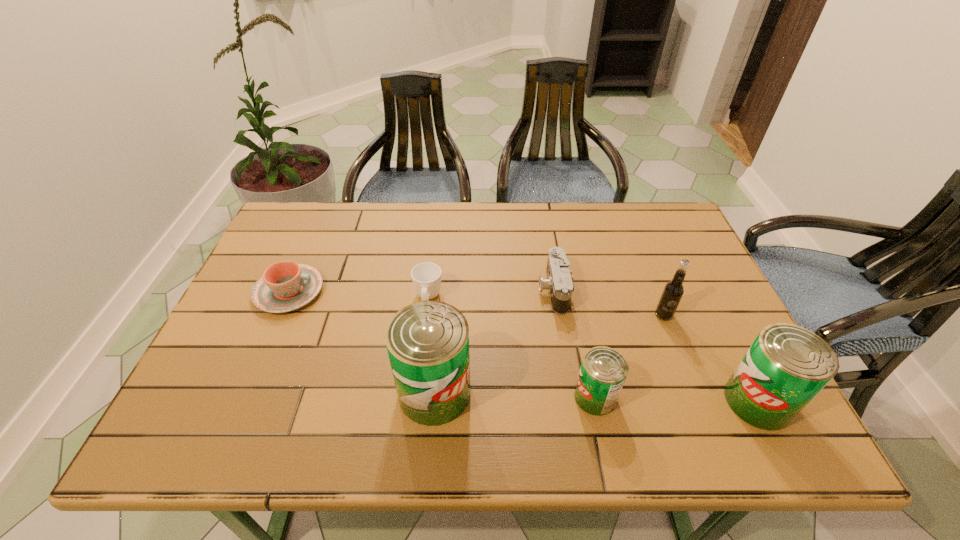
Locate an element on the screen. Image resolution: width=960 pixels, height=540 pixels. the leftmost can is located at coordinates (427, 342).

In order to click on the shortest can in this screenshot , I will do `click(603, 371)`.

At what (x,y) coordinates should I click in order to perform the action: click on the fourth shortest object. Please return your answer as a coordinate pair (x, y). Looking at the image, I should click on (603, 371).

Image resolution: width=960 pixels, height=540 pixels. I want to click on the second shortest can, so click(787, 365).

What are the coordinates of `the rightmost object` in the screenshot? It's located at (787, 365).

Where is `root beer`? This screenshot has height=540, width=960. root beer is located at coordinates (672, 293).

Find the location of a particular element. camera is located at coordinates (559, 284).

At what (x,y) coordinates should I click in order to perform the action: click on the leftmost object. Please return your answer as a coordinate pair (x, y). The image size is (960, 540). Looking at the image, I should click on (285, 286).

I want to click on cup, so click(426, 277).

I want to click on vacant space located 0.320m on the left of the leftmost can, so click(252, 393).